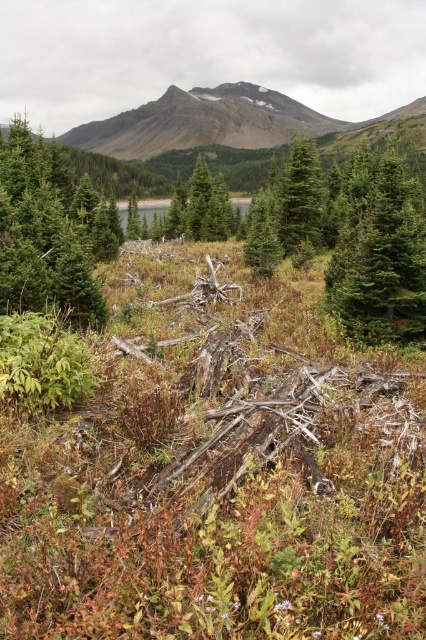
Question: Does green matte evergreen tree at center-right appear on the right side of green matte evergreen tree at upper left?

Choices:
 (A) yes
 (B) no

Answer: (A)

Question: Which point is farther to the camera?

Choices:
 (A) green matte evergreen tree at center
 (B) green matte tree at center

Answer: (B)

Question: Among these objects, which one is nearest to the camera?

Choices:
 (A) green matte evergreen tree at center-right
 (B) green matte tree at center
 (C) green matte evergreen tree at center
 (D) green matte evergreen tree at upper left

Answer: (D)

Question: Is green matte evergreen tree at upper left to the right of green matte evergreen tree at center from the viewer's perspective?

Choices:
 (A) yes
 (B) no

Answer: (B)

Question: Does green matte evergreen tree at upper left come behind green matte tree at center?

Choices:
 (A) no
 (B) yes

Answer: (A)

Question: Which of the following is the closest to the observer?

Choices:
 (A) (314, 196)
 (B) (222, 193)

Answer: (A)